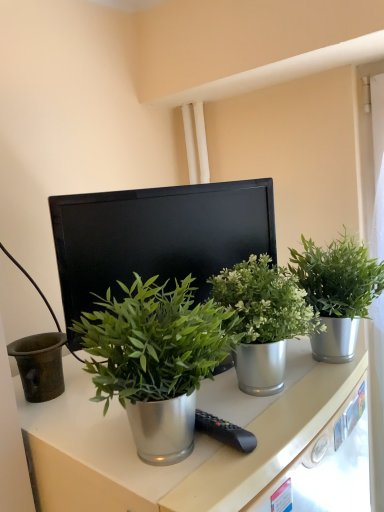
Describe the element at coordinates (328, 468) in the screenshot. I see `metallic drawer at lower right` at that location.

Where is `green metallic plant at center, which ranks as the third houseplant in left-to-right order`? The width and height of the screenshot is (384, 512). green metallic plant at center, which ranks as the third houseplant in left-to-right order is located at coordinates (337, 292).

You are a GUI agent. You are given a task and a screenshot of the screen. Output one action in this format:
    pyautogui.click(x=<x>, y=<y>)
    Task: Click on the metallic green plant at center, which is counted as the 2th houseplant, starting from the left
    
    Given the screenshot: What is the action you would take?
    pyautogui.click(x=264, y=319)

Find the location of a particular element. The height and width of the screenshot is (512, 384). green metallic plant at center, which ranks as the first houseplant in left-to-right order is located at coordinates point(156,360).

Locate an element on the screen. metallic drawer at lower right is located at coordinates [x=328, y=468].

Considering the positions of objects metallic green plant at center, the second houseplant viewed from the right, and black matte computer monitor at center in the image provided, who is behind, metallic green plant at center, the second houseplant viewed from the right, or black matte computer monitor at center?

Positioned behind is black matte computer monitor at center.

Is metallic green plant at center, which is counted as the 2th houseplant, starting from the left, bigger or smaller than black matte computer monitor at center?

Considering their sizes, metallic green plant at center, which is counted as the 2th houseplant, starting from the left, takes up less space than black matte computer monitor at center.

From a real-world perspective, is metallic green plant at center, the second houseplant viewed from the right, positioned above or below black matte computer monitor at center?

From a real-world perspective, metallic green plant at center, the second houseplant viewed from the right, is physically below black matte computer monitor at center.

Considering the sizes of objects metallic green plant at center, which is counted as the 2th houseplant, starting from the left, and black matte computer monitor at center in the image provided, who is wider, metallic green plant at center, which is counted as the 2th houseplant, starting from the left, or black matte computer monitor at center?

metallic green plant at center, which is counted as the 2th houseplant, starting from the left.

Image resolution: width=384 pixels, height=512 pixels. Find the location of `houseplant that is the 2nd one when counting leftward from the metallic drawer at lower right`. houseplant that is the 2nd one when counting leftward from the metallic drawer at lower right is located at coordinates (156, 360).

From a real-world perspective, which is physically above, metallic drawer at lower right or green metallic plant at center, which ranks as the first houseplant in left-to-right order?

green metallic plant at center, which ranks as the first houseplant in left-to-right order.

Considering the relative positions of metallic drawer at lower right and green metallic plant at center, which is counted as the 3th houseplant, starting from the right, in the image provided, is metallic drawer at lower right in front of green metallic plant at center, which is counted as the 3th houseplant, starting from the right,?

No, metallic drawer at lower right is further to the viewer.

Is green metallic plant at center, which ranks as the first houseplant in left-to-right order, positioned with its back to black matte computer monitor at center?

green metallic plant at center, which ranks as the first houseplant in left-to-right order, is not turned away from black matte computer monitor at center.

Which is behind, point (202, 327) or point (222, 216)?

Positioned behind is point (222, 216).

From the image's perspective, which is above, green metallic plant at center, which ranks as the first houseplant in left-to-right order, or black matte computer monitor at center?

black matte computer monitor at center, from the image's perspective.

Considering the sizes of objects green metallic plant at center, which is counted as the 3th houseplant, starting from the right, and black matte computer monitor at center in the image provided, who is taller, green metallic plant at center, which is counted as the 3th houseplant, starting from the right, or black matte computer monitor at center?

black matte computer monitor at center is taller.

Can you see green metallic plant at center, which ranks as the third houseplant in left-to-right order, touching metallic green plant at center, the second houseplant viewed from the right?

No, green metallic plant at center, which ranks as the third houseplant in left-to-right order, is not in contact with metallic green plant at center, the second houseplant viewed from the right.

How much distance is there between green metallic plant at center, which ranks as the third houseplant in left-to-right order, and metallic green plant at center, which is counted as the 2th houseplant, starting from the left?

The distance of green metallic plant at center, which ranks as the third houseplant in left-to-right order, from metallic green plant at center, which is counted as the 2th houseplant, starting from the left, is 4.12 inches.

Does point (334, 338) lie behind point (261, 312)?

Yes, point (334, 338) is farther from viewer.

Is green metallic plant at center, which ranks as the third houseplant in left-to-right order, outside of metallic green plant at center, the second houseplant viewed from the right?

That's correct, green metallic plant at center, which ranks as the third houseplant in left-to-right order, is outside of metallic green plant at center, the second houseplant viewed from the right.

Which is farther, (352, 436) or (354, 337)?

The point (354, 337) is farther.

Is metallic drawer at lower right aimed at green metallic plant at center, which ranks as the third houseplant in left-to-right order?

No.

Is metallic drawer at lower right in front of or behind green metallic plant at center, which is the first houseplant from right to left, in the image?

metallic drawer at lower right is in front of green metallic plant at center, which is the first houseplant from right to left.

Considering the relative sizes of metallic drawer at lower right and green metallic plant at center, which is the first houseplant from right to left, in the image provided, is metallic drawer at lower right taller than green metallic plant at center, which is the first houseplant from right to left,?

No, metallic drawer at lower right is not taller than green metallic plant at center, which is the first houseplant from right to left.

Which of these two, metallic green plant at center, the second houseplant viewed from the right, or green metallic plant at center, which ranks as the third houseplant in left-to-right order, stands taller?

Standing taller between the two is green metallic plant at center, which ranks as the third houseplant in left-to-right order.

Between metallic green plant at center, which is counted as the 2th houseplant, starting from the left, and green metallic plant at center, which ranks as the third houseplant in left-to-right order, which one is positioned in front?

metallic green plant at center, which is counted as the 2th houseplant, starting from the left, is in front.

Does metallic green plant at center, the second houseplant viewed from the right, turn towards green metallic plant at center, which ranks as the third houseplant in left-to-right order?

No, metallic green plant at center, the second houseplant viewed from the right, is not turned towards green metallic plant at center, which ranks as the third houseplant in left-to-right order.

Identify the location of drawer below the black matte computer monitor at center (from a real-world perspective). (328, 468).

In the scene shown: Is metallic drawer at lower right aimed at black matte computer monitor at center?

No, metallic drawer at lower right does not turn towards black matte computer monitor at center.

Is metallic drawer at lower right positioned before black matte computer monitor at center?

Yes, metallic drawer at lower right is closer to the camera.

Considering the relative sizes of metallic drawer at lower right and black matte computer monitor at center in the image provided, is metallic drawer at lower right wider than black matte computer monitor at center?

Incorrect, the width of metallic drawer at lower right does not surpass that of black matte computer monitor at center.

Locate an element on the screen. computer monitor above the metallic green plant at center, which is counted as the 2th houseplant, starting from the left (from a real-world perspective) is located at coordinates (156, 238).

Find the location of `drawer on the right of the green metallic plant at center, which ranks as the first houseplant in left-to-right order`. drawer on the right of the green metallic plant at center, which ranks as the first houseplant in left-to-right order is located at coordinates (328, 468).

Looking at this image, from the image, which object appears to be farther from green metallic plant at center, which is counted as the 3th houseplant, starting from the right, black matte computer monitor at center or green metallic plant at center, which ranks as the third houseplant in left-to-right order?

green metallic plant at center, which ranks as the third houseplant in left-to-right order, is positioned further to the anchor green metallic plant at center, which is counted as the 3th houseplant, starting from the right.

From the image, which object appears to be farther from metallic green plant at center, the second houseplant viewed from the right, black matte computer monitor at center or metallic drawer at lower right?

metallic drawer at lower right lies further to metallic green plant at center, the second houseplant viewed from the right, than the other object.

Estimate the real-world distances between objects in this image. Which object is closer to green metallic plant at center, which ranks as the first houseplant in left-to-right order, black matte computer monitor at center or metallic drawer at lower right?

black matte computer monitor at center is closer to green metallic plant at center, which ranks as the first houseplant in left-to-right order.

Which object lies nearer to the anchor point green metallic plant at center, which is counted as the 3th houseplant, starting from the right, metallic green plant at center, which is counted as the 2th houseplant, starting from the left, or green metallic plant at center, which ranks as the third houseplant in left-to-right order?

The object closer to green metallic plant at center, which is counted as the 3th houseplant, starting from the right, is metallic green plant at center, which is counted as the 2th houseplant, starting from the left.

From the image, which object appears to be farther from green metallic plant at center, which is counted as the 3th houseplant, starting from the right, metallic drawer at lower right or green metallic plant at center, which ranks as the third houseplant in left-to-right order?

The object further to green metallic plant at center, which is counted as the 3th houseplant, starting from the right, is green metallic plant at center, which ranks as the third houseplant in left-to-right order.

Which object lies further to the anchor point black matte computer monitor at center, green metallic plant at center, which is the first houseplant from right to left, or green metallic plant at center, which is counted as the 3th houseplant, starting from the right?

green metallic plant at center, which is the first houseplant from right to left, is further to black matte computer monitor at center.

When comparing their distances from metallic green plant at center, which is counted as the 2th houseplant, starting from the left, does black matte computer monitor at center or green metallic plant at center, which is counted as the 3th houseplant, starting from the right, seem closer?

green metallic plant at center, which is counted as the 3th houseplant, starting from the right.

Considering their positions, is green metallic plant at center, which ranks as the third houseplant in left-to-right order, positioned closer to metallic green plant at center, which is counted as the 2th houseplant, starting from the left, than metallic drawer at lower right?

Among the two, green metallic plant at center, which ranks as the third houseplant in left-to-right order, is located nearer to metallic green plant at center, which is counted as the 2th houseplant, starting from the left.

At what (x,y) coordinates should I click in order to perform the action: click on houseplant that lies between metallic green plant at center, which is counted as the 2th houseplant, starting from the left, and metallic drawer at lower right from top to bottom. Please return your answer as a coordinate pair (x, y). The width and height of the screenshot is (384, 512). Looking at the image, I should click on (156, 360).

You are a GUI agent. You are given a task and a screenshot of the screen. Output one action in this format:
    pyautogui.click(x=<x>, y=<y>)
    Task: Click on the houseplant between green metallic plant at center, which is counted as the 3th houseplant, starting from the right, and green metallic plant at center, which ranks as the third houseplant in left-to-right order, in the horizontal direction
    
    Given the screenshot: What is the action you would take?
    pyautogui.click(x=264, y=319)

I want to click on houseplant situated between black matte computer monitor at center and green metallic plant at center, which ranks as the third houseplant in left-to-right order, from left to right, so click(x=264, y=319).

Image resolution: width=384 pixels, height=512 pixels. Find the location of `drawer between green metallic plant at center, which ranks as the first houseplant in left-to-right order, and black matte computer monitor at center from front to back`. drawer between green metallic plant at center, which ranks as the first houseplant in left-to-right order, and black matte computer monitor at center from front to back is located at coordinates (328, 468).